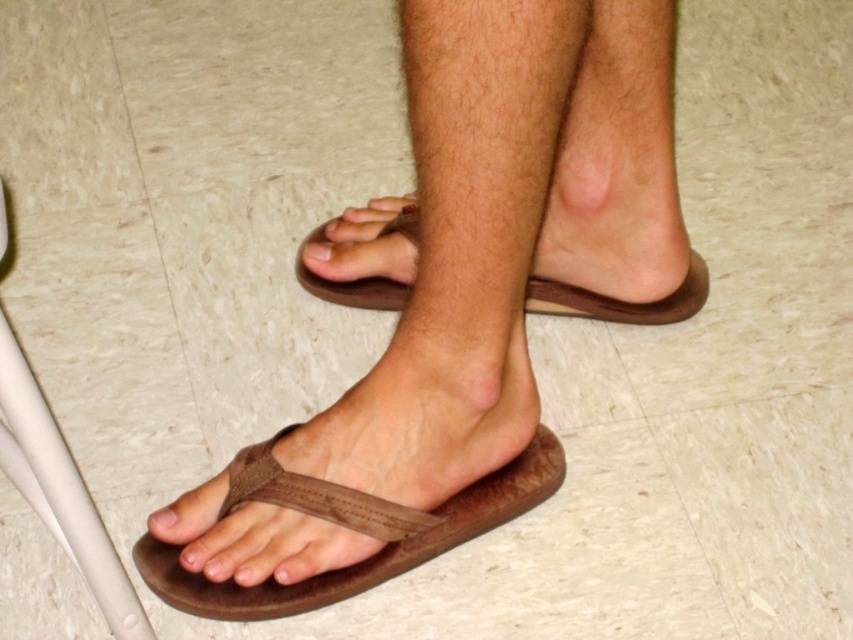
Question: Does brown leather sandal at center appear over matte brown toe at lower left?

Choices:
 (A) no
 (B) yes

Answer: (B)

Question: Where is brown leather sandal at lower left located in relation to brown leather toe at center in the image?

Choices:
 (A) right
 (B) left

Answer: (A)

Question: Among these objects, which one is farthest from the camera?

Choices:
 (A) brown leather flip-flops at center
 (B) brown leather sandal at center
 (C) matte brown toe at lower left

Answer: (B)

Question: Among these points, which one is farthest from the camera?

Choices:
 (A) (328, 220)
 (B) (148, 529)
 (C) (373, 580)
 (D) (332, 243)

Answer: (A)

Question: Observing the image, what is the correct spatial positioning of brown leather sandal at center in reference to brown leather toe at center?

Choices:
 (A) right
 (B) left

Answer: (A)

Question: Which point is closer to the camera?

Choices:
 (A) brown leather toe at center
 (B) brown leather sandal at center
 (C) brown leather flip-flops at center
 (D) matte brown toe at lower left

Answer: (C)